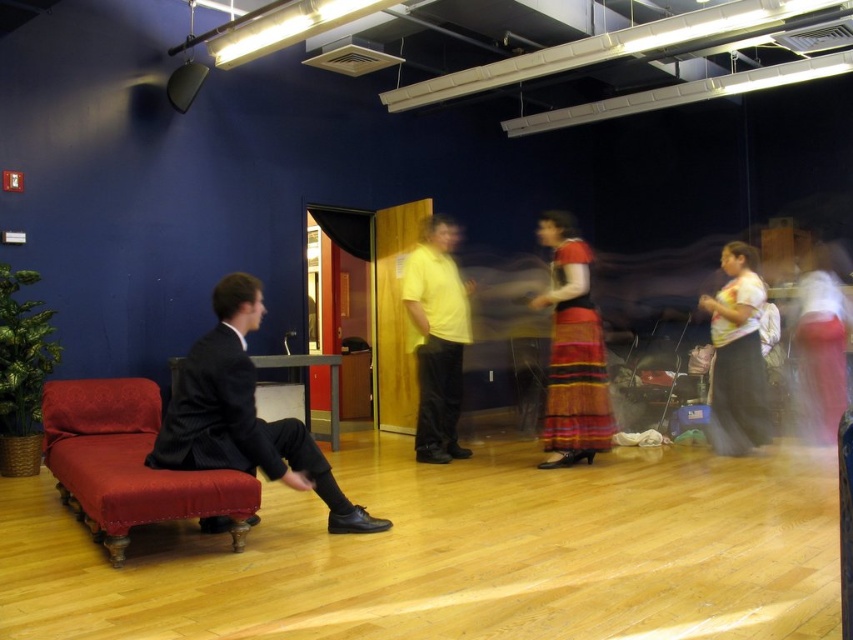
Question: Can you confirm if multicolored woven skirt at center is positioned below yellow matte shirt at center?

Choices:
 (A) yes
 (B) no

Answer: (B)

Question: Among these objects, which one is nearest to the camera?

Choices:
 (A) velvet red couch at left
 (B) white t-shirt at right
 (C) black suit at left

Answer: (A)

Question: Which point is farther from the camera taking this photo?

Choices:
 (A) (566, 278)
 (B) (135, 481)
 (C) (422, 371)
 (D) (723, 252)

Answer: (D)

Question: Is multicolored woven skirt at center thinner than yellow matte shirt at center?

Choices:
 (A) no
 (B) yes

Answer: (A)

Question: Is velvet red couch at left wider than multicolored woven skirt at center?

Choices:
 (A) yes
 (B) no

Answer: (A)

Question: Which object is positioned farthest from the yellow matte shirt at center?

Choices:
 (A) white t-shirt at right
 (B) velvet red couch at left
 (C) black suit at left
 (D) multicolored woven skirt at center

Answer: (B)